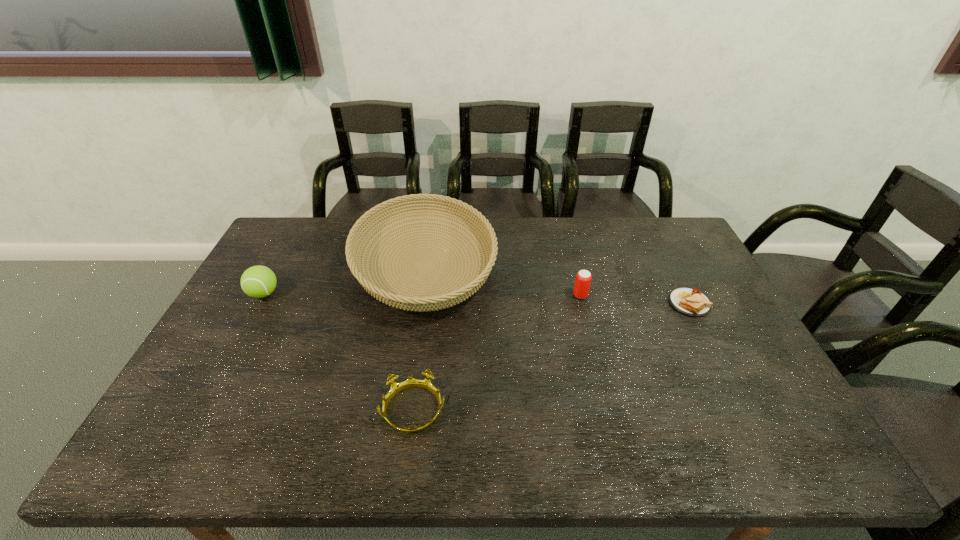
In order to click on basket in this screenshot , I will do `click(436, 298)`.

Locate an element on the screen. The width and height of the screenshot is (960, 540). the leftmost object is located at coordinates (258, 281).

Image resolution: width=960 pixels, height=540 pixels. I want to click on beer can, so click(x=583, y=278).

Locate an element on the screen. The height and width of the screenshot is (540, 960). the fourth tallest object is located at coordinates (426, 384).

You are a GUI agent. You are given a task and a screenshot of the screen. Output one action in this format:
    pyautogui.click(x=<x>, y=<y>)
    Task: Click on the crown
    
    Given the screenshot: What is the action you would take?
    pyautogui.click(x=426, y=384)

The width and height of the screenshot is (960, 540). Find the location of `sandwich`. sandwich is located at coordinates (691, 302).

Identify the location of the rightmost object. (691, 302).

Locate an element on the screen. vacant region located 0.390m on the front of the basket is located at coordinates (x=396, y=462).

The image size is (960, 540). Find the location of `free location located on the back of the leftmost object`. free location located on the back of the leftmost object is located at coordinates (296, 234).

Locate an element on the screen. The image size is (960, 540). blank space located 0.310m on the front of the fourth object from left to right is located at coordinates (603, 385).